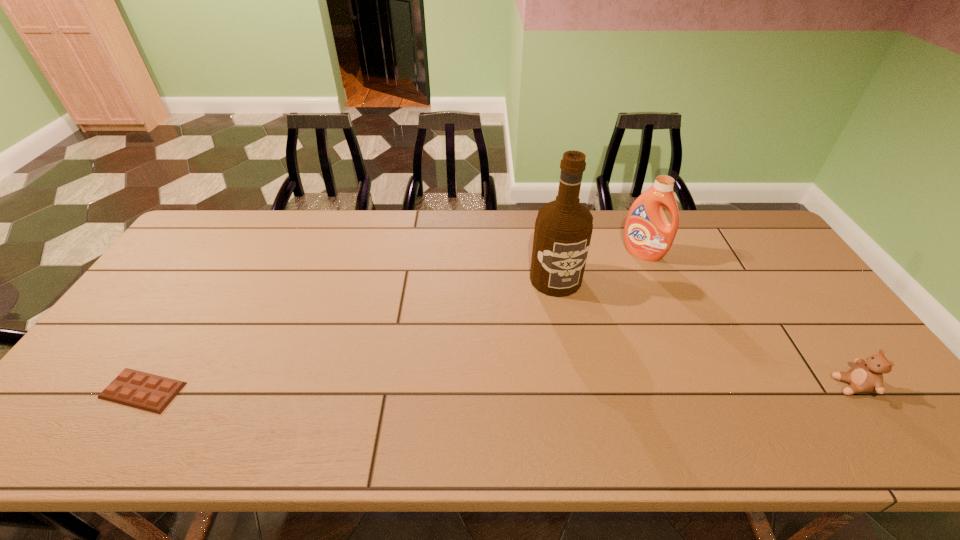
This screenshot has width=960, height=540. I want to click on vacant space at the near right corner of the desktop, so click(x=844, y=395).

Where is `vacant space that is in between the third shortest object and the alcohol`? vacant space that is in between the third shortest object and the alcohol is located at coordinates (599, 266).

Locate an element on the screen. The height and width of the screenshot is (540, 960). free area in between the rightmost object and the shortest object is located at coordinates (497, 388).

This screenshot has height=540, width=960. In order to click on free spot between the teddy bear and the tallest object in this screenshot , I will do `click(704, 333)`.

The image size is (960, 540). In order to click on free space between the third object from left to right and the third tallest object in this screenshot , I will do `click(747, 320)`.

Identify the location of unoccupied position between the detergent and the third tallest object. This screenshot has height=540, width=960. (747, 320).

Find the location of a particular element. The image size is (960, 540). blank region between the leftmost object and the teddy bear is located at coordinates (497, 388).

At what (x,y) coordinates should I click in order to perform the action: click on free area in between the third tallest object and the second object from right to left. Please return your answer as a coordinate pair (x, y). Looking at the image, I should click on (747, 320).

The width and height of the screenshot is (960, 540). Identify the location of vacant area that lies between the rightmost object and the chocolate bar. (497, 388).

Where is `vacant space that is in between the rightmost object and the shortest object`? vacant space that is in between the rightmost object and the shortest object is located at coordinates (497, 388).